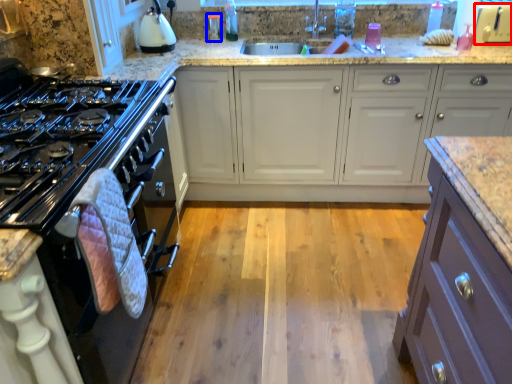
Question: Among these objects, which one is farthest to the camera, appliance (highlighted by a red box) or appliance (highlighted by a blue box)?

Choices:
 (A) appliance
 (B) appliance

Answer: (B)